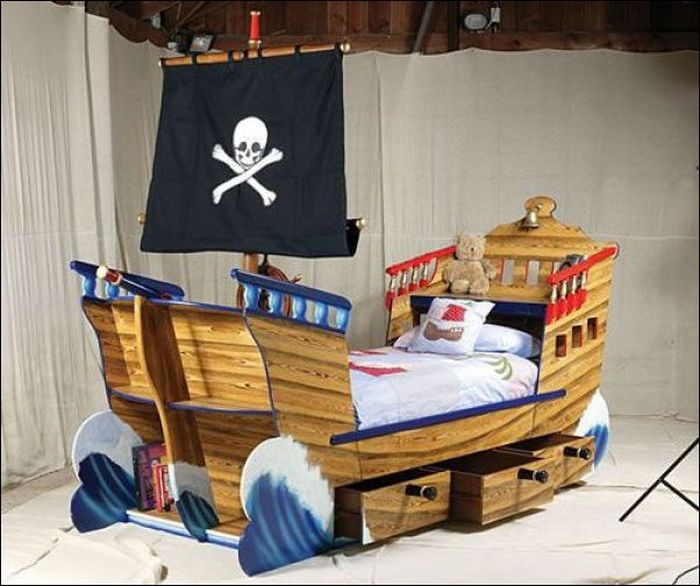
At what (x,y) coordinates should I click in order to perform the action: click on pillow. Please return your answer as a coordinate pair (x, y). The image size is (700, 586). Looking at the image, I should click on (460, 322), (495, 343).